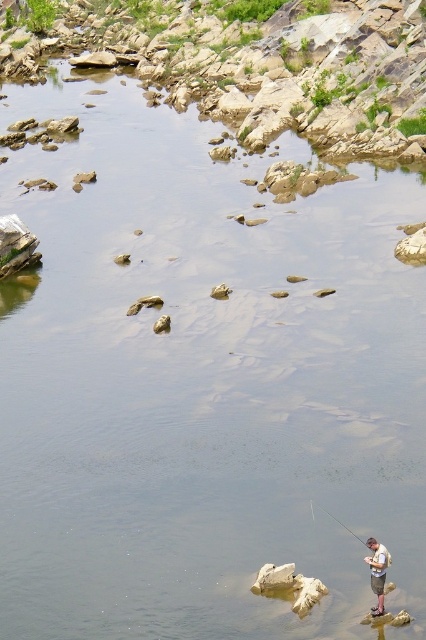
You are standing at the edge of the water and want to retrieve your khaki shorts at lower right. Can you reach them without moving from your current position?

The khaki shorts at lower right are 68.48 feet away from the viewer, so you cannot reach them without moving from your current position.

You are observing a person fishing by the water. Which item, the khaki shorts at lower right or the smooth black rod at lower right, is wider?

The smooth black rod at lower right is wider than the khaki shorts at lower right.